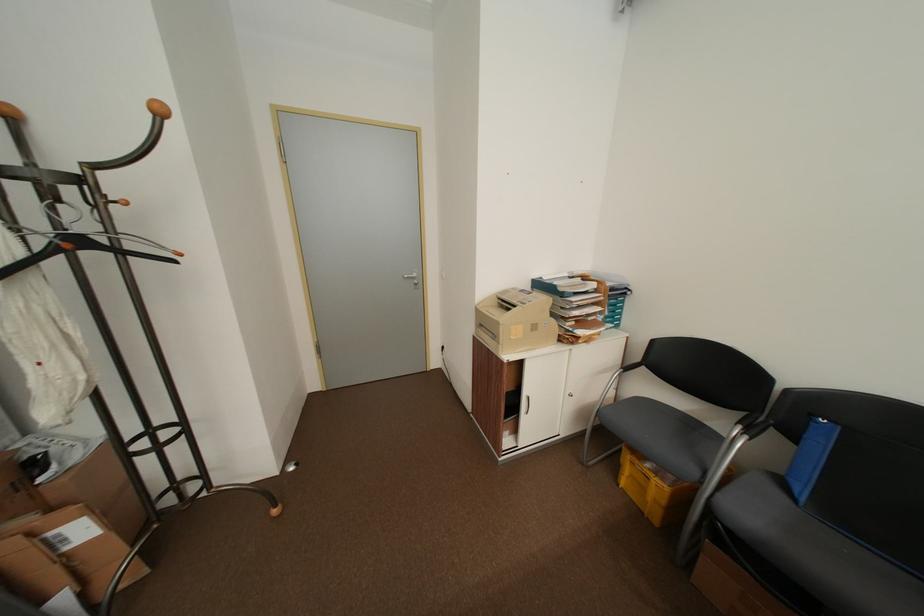
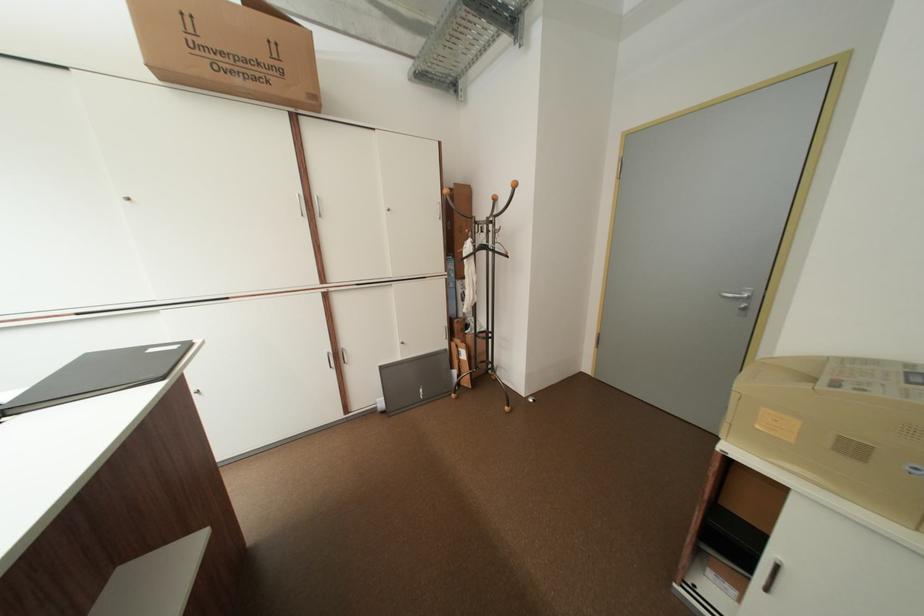
Question: The camera is either moving clockwise (left) or counter-clockwise (right) around the object. The first image is from the beginning of the video and the second image is from the end. Is the camera moving left or right when shooting the video?

Choices:
 (A) Left
 (B) Right

Answer: (B)